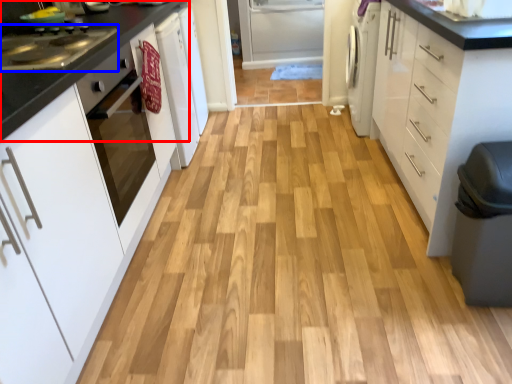
Question: Which point is closer to the camera, countertop (highlighted by a red box) or kitchen appliance (highlighted by a blue box)?

Choices:
 (A) countertop
 (B) kitchen appliance

Answer: (B)